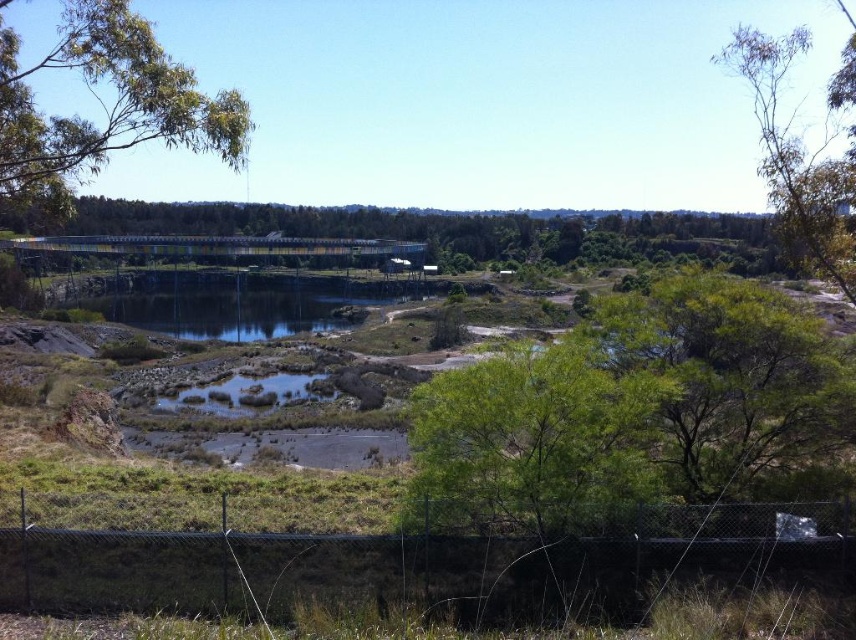
Question: In this image, where is green leafy tree at upper left located relative to green leafy tree at upper right?

Choices:
 (A) below
 (B) above

Answer: (A)

Question: Estimate the real-world distances between objects in this image. Which object is closer to the clear water at center?

Choices:
 (A) green leafy tree at center
 (B) green leafy tree at upper left

Answer: (B)

Question: Does green leafy tree at lower right have a lesser width compared to green leafy tree at upper right?

Choices:
 (A) no
 (B) yes

Answer: (B)

Question: Where is green leafy tree at center located in relation to green leafy tree at lower right in the image?

Choices:
 (A) above
 (B) below

Answer: (A)

Question: Which object is farther from the camera taking this photo?

Choices:
 (A) clear water at center
 (B) green leafy tree at center
 (C) green leafy tree at upper right

Answer: (A)

Question: Which point is farther to the camera?

Choices:
 (A) green leafy tree at upper right
 (B) green leafy tree at upper left
 (C) clear water at center

Answer: (C)